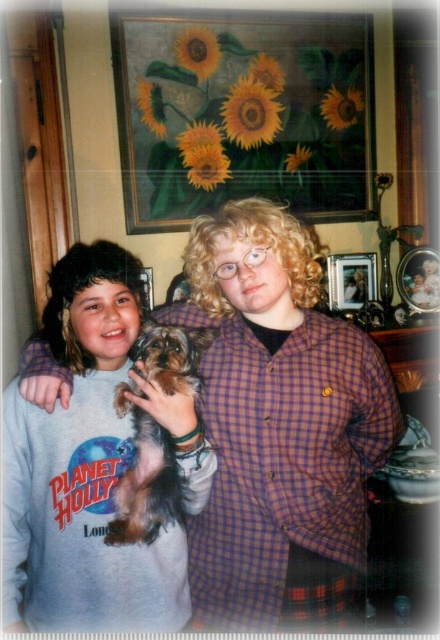
Is point (315, 598) less distant than point (145, 504)?

No, it is behind (145, 504).

Who is positioned more to the left, plaid shirt at center or fuzzy brown dog at center?

fuzzy brown dog at center

Which is behind, point (330, 321) or point (187, 346)?

Positioned behind is point (330, 321).

The height and width of the screenshot is (640, 440). Find the location of `plaid shirt at center`. plaid shirt at center is located at coordinates (279, 426).

Is plaid shirt at center positioned behind light gray sweatshirt at center?

That is True.

Identify the location of plaid shirt at center. (279, 426).

The width and height of the screenshot is (440, 640). What are the coordinates of `plaid shirt at center` in the screenshot? It's located at (279, 426).

Can you confirm if light gray sweatshirt at center is positioned below fuzzy brown dog at center?

Yes, light gray sweatshirt at center is below fuzzy brown dog at center.

Can you confirm if light gray sweatshirt at center is wider than fuzzy brown dog at center?

Yes.

Who is more forward, (172, 541) or (154, 420)?

Point (154, 420) is in front.

Identify the location of light gray sweatshirt at center. The image size is (440, 640). (91, 468).